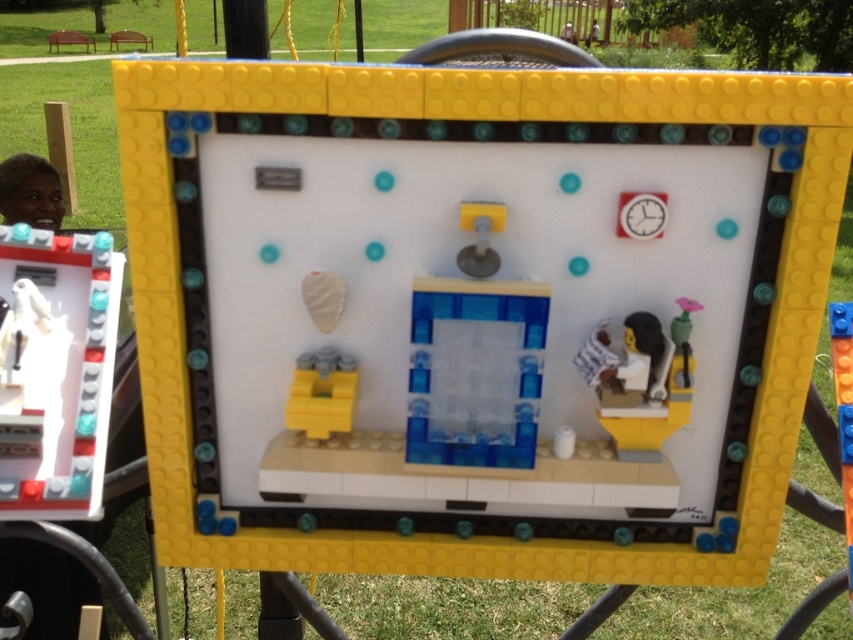
You are a delivery robot with a package that needs to be placed between the yellow plastic bricks at lower left and the smooth plastic figure at right. The package is 14 inches long. Will it fit between them?

The yellow plastic bricks at lower left is 14.35 inches away from the smooth plastic figure at right. Since the package is 14 inches long, it will fit between them as the distance is slightly larger than the package length.

You are standing in front of the LEGO diorama and notice the white glossy statue at left and the smooth plastic figure at right. Which object is positioned lower in the scene?

The white glossy statue at left is located below the smooth plastic figure at right, so it is positioned lower in the scene.